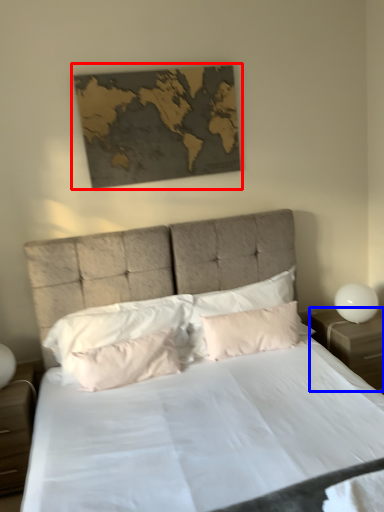
Question: Which of the following is the closest to the observer, picture frame (highlighted by a red box) or nightstand (highlighted by a blue box)?

Choices:
 (A) picture frame
 (B) nightstand

Answer: (A)